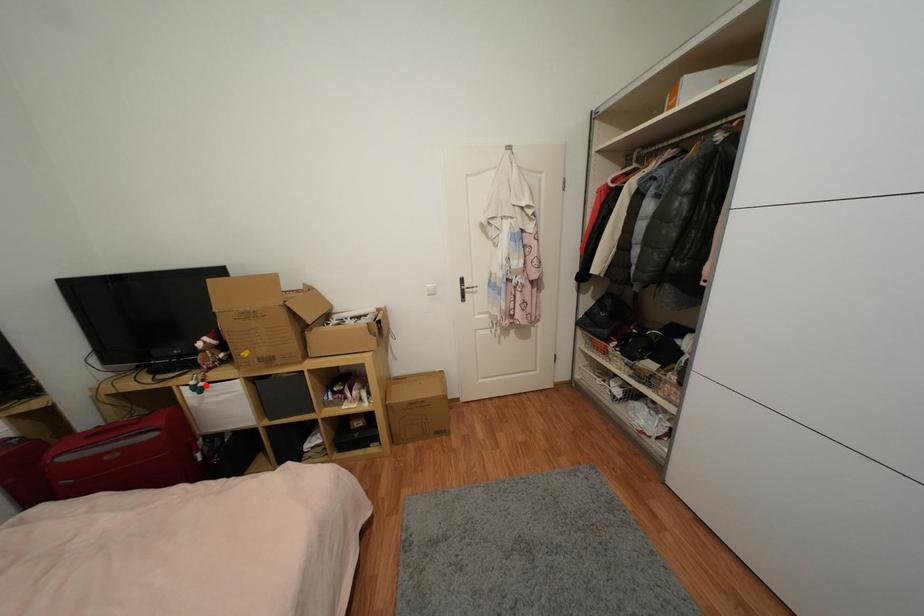
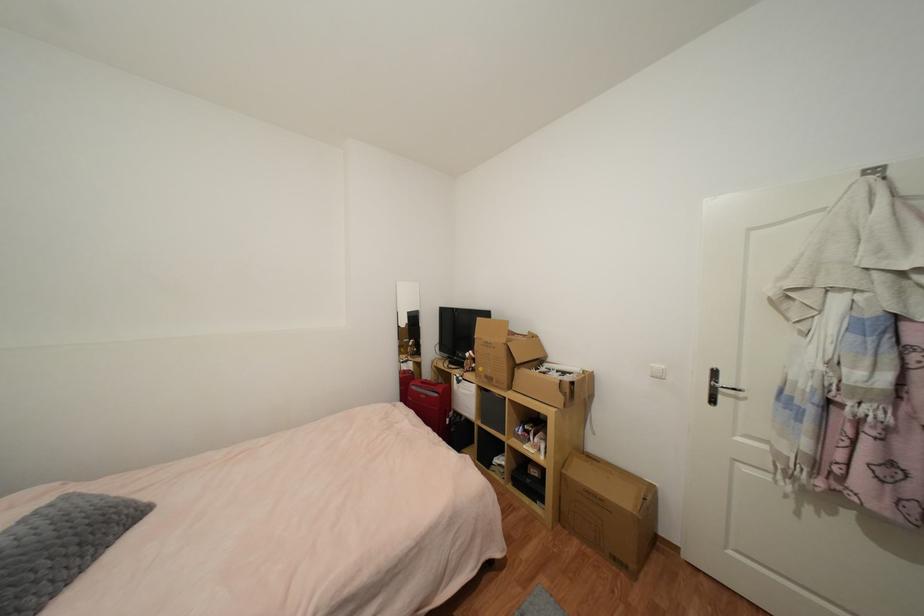
Question: A red point is marked in image1. In image2, is the corresponding 3D point closer to the camera or farther? Reply with the corresponding letter.

Choices:
 (A) The corresponding 3D point is closer.
 (B) The corresponding 3D point is farther.

Answer: (B)